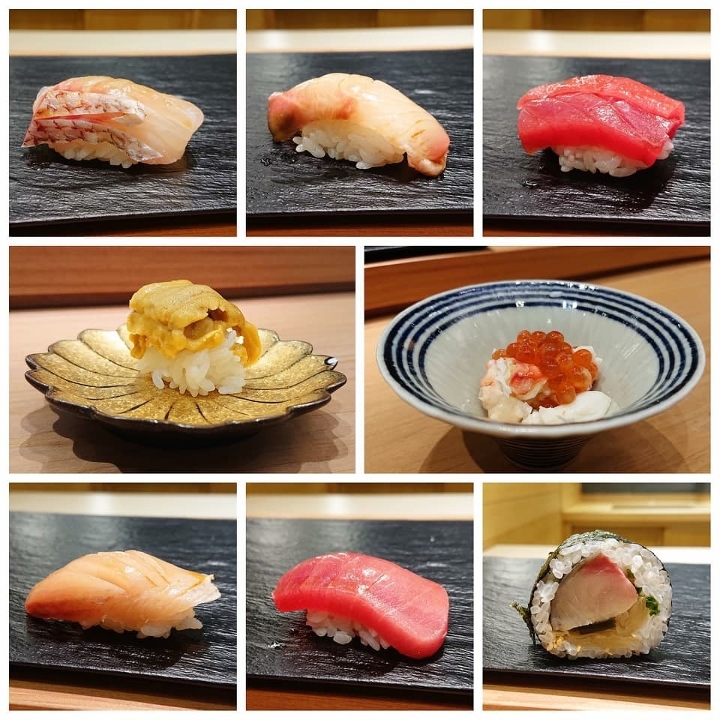
Identify the location of fancy plate. This screenshot has height=720, width=720. (294, 384).